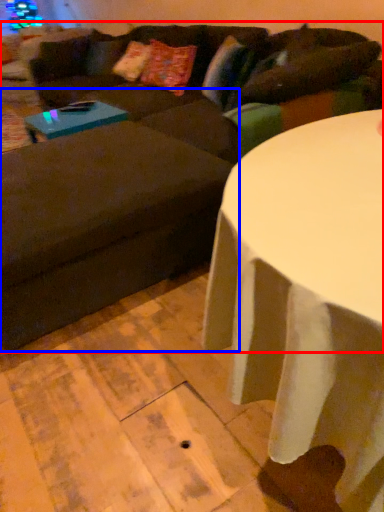
Question: Which object appears farthest to the camera in this image, studio couch (highlighted by a red box) or swivel chair (highlighted by a blue box)?

Choices:
 (A) studio couch
 (B) swivel chair

Answer: (B)